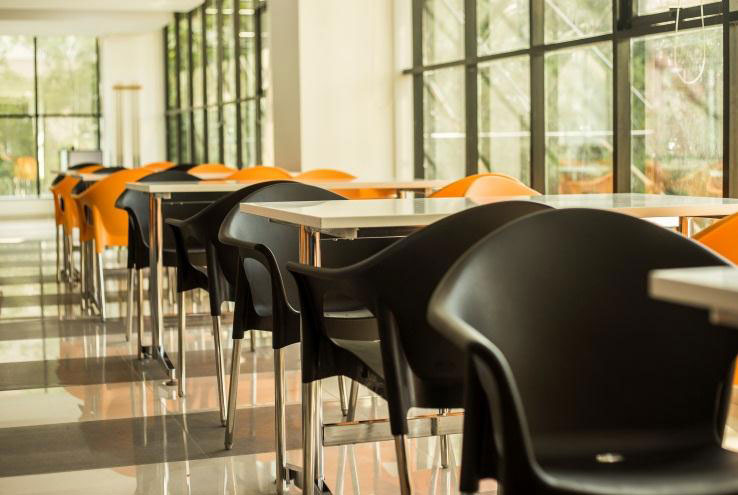
This screenshot has height=495, width=738. In order to click on tables in this screenshot , I will do `click(711, 285)`, `click(370, 211)`, `click(167, 187)`, `click(97, 176)`, `click(61, 170)`.